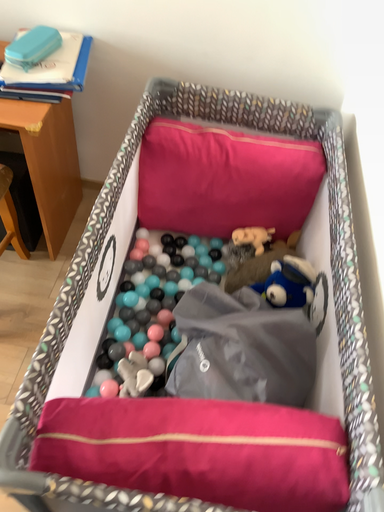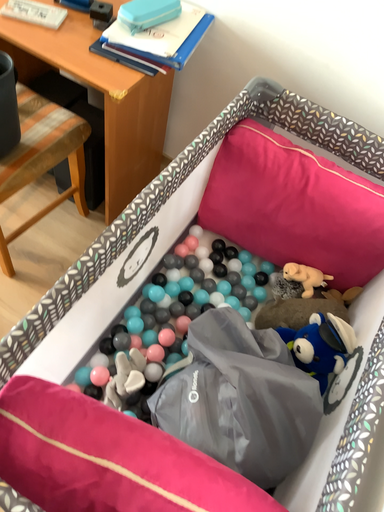
Question: Which way did the camera rotate in the video?

Choices:
 (A) rotated left
 (B) rotated right

Answer: (A)